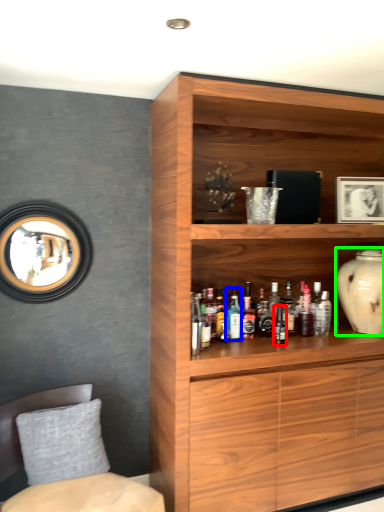
Question: Estimate the real-world distances between objects in this image. Which object is closer to bottle (highlighted by a red box), bottle (highlighted by a blue box) or vase (highlighted by a green box)?

Choices:
 (A) bottle
 (B) vase

Answer: (A)